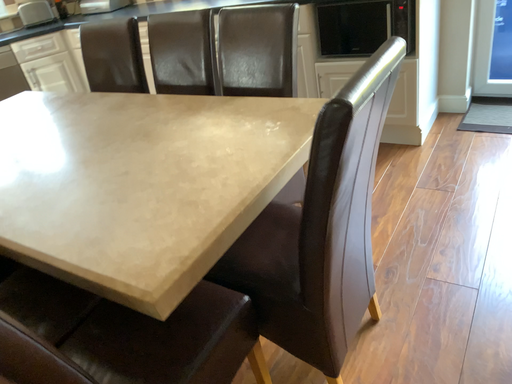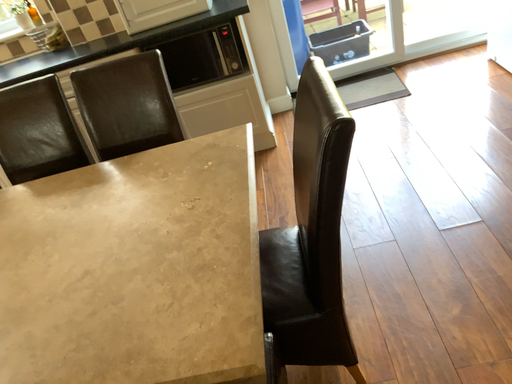
Question: Which way did the camera rotate in the video?

Choices:
 (A) rotated left
 (B) rotated right

Answer: (B)